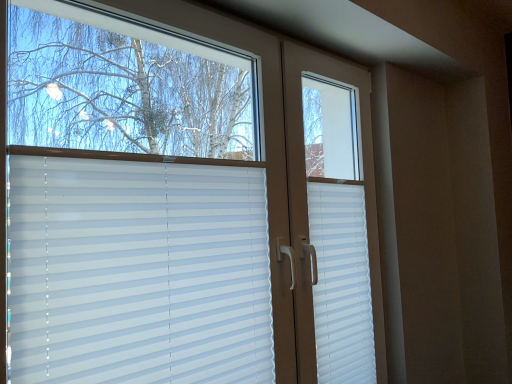
Question: Is white plastic blinds at center far away from white plastic blinds at center?

Choices:
 (A) yes
 (B) no

Answer: (B)

Question: Can white plastic blinds at center be found inside white plastic blinds at center?

Choices:
 (A) no
 (B) yes

Answer: (A)

Question: From the image's perspective, is white plastic blinds at center on top of white plastic blinds at center?

Choices:
 (A) no
 (B) yes

Answer: (A)

Question: Is white plastic blinds at center touching white plastic blinds at center?

Choices:
 (A) no
 (B) yes

Answer: (A)

Question: Considering the relative sizes of white plastic blinds at center and white plastic blinds at center in the image provided, is white plastic blinds at center bigger than white plastic blinds at center?

Choices:
 (A) yes
 (B) no

Answer: (B)

Question: Looking at their shapes, would you say white plastic blinds at center is wider or thinner than white plastic blinds at center?

Choices:
 (A) thin
 (B) wide

Answer: (B)

Question: Is white plastic blinds at center inside the boundaries of white plastic blinds at center, or outside?

Choices:
 (A) inside
 (B) outside

Answer: (B)

Question: Is white plastic blinds at center bigger or smaller than white plastic blinds at center?

Choices:
 (A) small
 (B) big

Answer: (B)

Question: From a real-world perspective, relative to white plastic blinds at center, is white plastic blinds at center vertically above or below?

Choices:
 (A) above
 (B) below

Answer: (A)

Question: From a real-world perspective, is white plastic shutter at right above or below white plastic blinds at center?

Choices:
 (A) above
 (B) below

Answer: (B)

Question: Is point (333, 349) closer or farther from the camera than point (138, 342)?

Choices:
 (A) farther
 (B) closer

Answer: (A)

Question: Is white plastic shutter at right spatially inside white plastic blinds at center, or outside of it?

Choices:
 (A) outside
 (B) inside

Answer: (B)

Question: Is white plastic shutter at right in front of or behind white plastic blinds at center in the image?

Choices:
 (A) behind
 (B) front

Answer: (A)

Question: From the image's perspective, is white plastic blinds at center above or below white plastic shutter at right?

Choices:
 (A) below
 (B) above

Answer: (B)

Question: Visually, is white plastic blinds at center positioned to the left or to the right of white plastic shutter at right?

Choices:
 (A) left
 (B) right

Answer: (A)